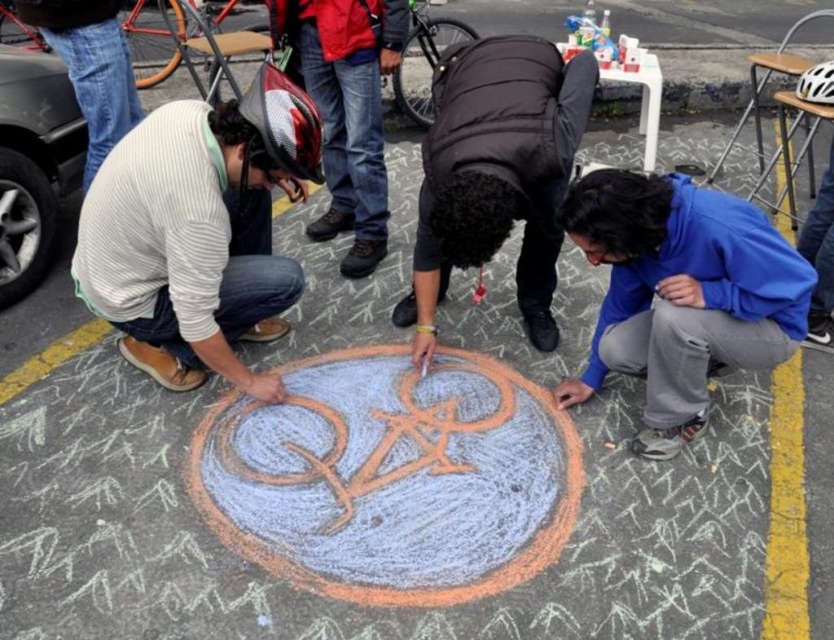
Measure the distance between point [677,353] and camera.

Point [677,353] is 7.32 feet away from camera.

Between blue fleece jacket at lower right and dark brown puffy jacket at center, which one is positioned higher?

dark brown puffy jacket at center is higher up.

This screenshot has height=640, width=834. What do you see at coordinates (681, 292) in the screenshot?
I see `blue fleece jacket at lower right` at bounding box center [681, 292].

The image size is (834, 640). In order to click on blue fleece jacket at lower right in this screenshot , I will do `click(681, 292)`.

Between point (235, 356) and point (431, 307), which one is positioned in front?

Point (235, 356) is in front.

You are a GUI agent. You are given a task and a screenshot of the screen. Output one action in this format:
    pyautogui.click(x=<x>, y=<y>)
    Task: Click on the striped sweater at left
    
    Given the screenshot: What is the action you would take?
    pyautogui.click(x=197, y=230)

In the scene shown: Can you confirm if striped sweater at left is positioned below blue fleece jacket at lower right?

Actually, striped sweater at left is above blue fleece jacket at lower right.

Is the position of striped sweater at left less distant than that of blue fleece jacket at lower right?

No.

Does point (309, 109) lie behind point (671, 316)?

Yes.

Find the location of `striped sweater at left`. striped sweater at left is located at coordinates (197, 230).